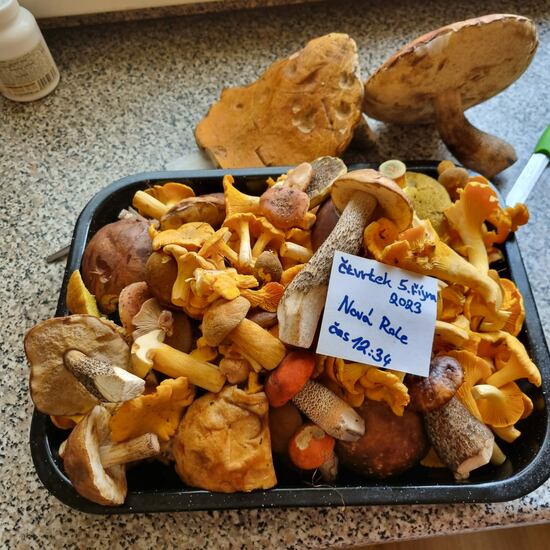
You are a GUI agent. You are given a task and a screenshot of the screen. Output one action in this format:
    pyautogui.click(x=<x>, y=<y>)
    Task: Click on the bottle
    
    Given the screenshot: What is the action you would take?
    pyautogui.click(x=19, y=73)